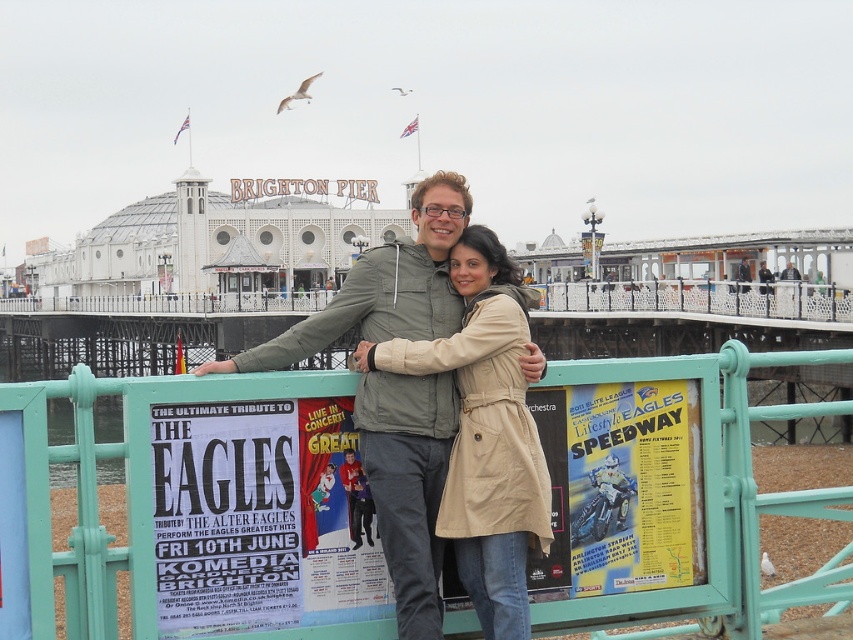
Is teal metal fence at center below white paper poster at center?

No.

Can you confirm if teal metal fence at center is positioned above white paper poster at center?

Indeed, teal metal fence at center is positioned over white paper poster at center.

Who is more forward, (27,528) or (234,536)?

Positioned in front is point (27,528).

Find the location of a particular element. This screenshot has height=640, width=853. teal metal fence at center is located at coordinates (126, 488).

Which of these two, beige fabric coat at center or white paper poster at center, stands shorter?

beige fabric coat at center is shorter.

Between beige fabric coat at center and white paper poster at center, which one appears on the left side from the viewer's perspective?

Positioned to the left is white paper poster at center.

Who is more forward, (543, 476) or (265, 612)?

Point (265, 612)

Locate an element on the screen. This screenshot has height=640, width=853. beige fabric coat at center is located at coordinates (485, 433).

Is teal metal fence at center to the right of green matte jacket at center from the viewer's perspective?

Indeed, teal metal fence at center is positioned on the right side of green matte jacket at center.

Is point (314, 636) positioned behind point (431, 428)?

No, (314, 636) is in front of (431, 428).

Where is `teal metal fence at center`? teal metal fence at center is located at coordinates (126, 488).

Identify the location of teal metal fence at center. This screenshot has width=853, height=640. (126, 488).